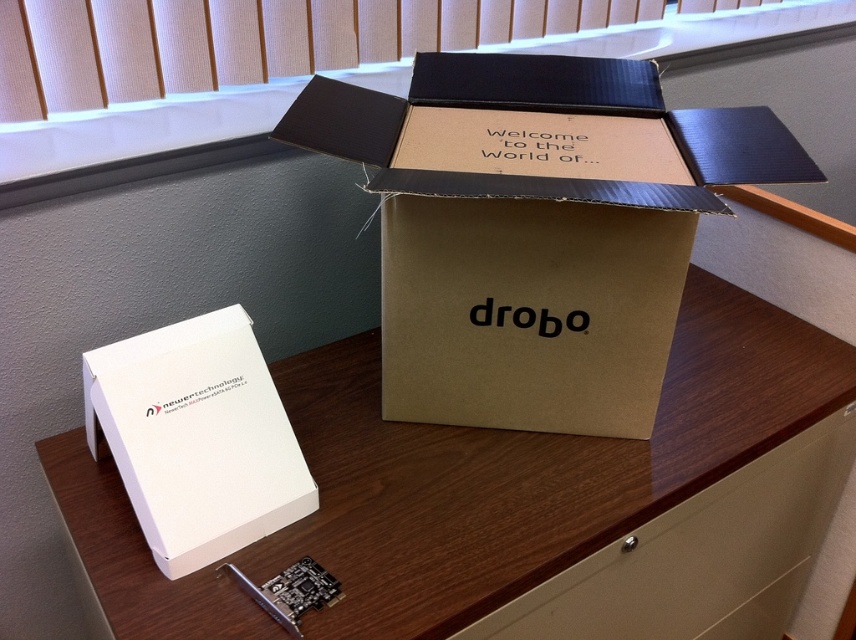
Is white cardboard box at center bigger than white matte/newer technology box at lower left?

Yes, white cardboard box at center is bigger than white matte/newer technology box at lower left.

Between white cardboard box at center and white matte/newer technology box at lower left, which one has more height?

Standing taller between the two is white cardboard box at center.

The width and height of the screenshot is (856, 640). I want to click on white cardboard box at center, so click(530, 468).

Can you confirm if white cardboard box at center is bigger than brown cardboard box at center?

Correct, white cardboard box at center is larger in size than brown cardboard box at center.

Does white cardboard box at center appear over brown cardboard box at center?

No, white cardboard box at center is not above brown cardboard box at center.

Who is more distant from viewer, (440, 541) or (465, 275)?

The point (465, 275) is more distant.

You are a GUI agent. You are given a task and a screenshot of the screen. Output one action in this format:
    pyautogui.click(x=<x>, y=<y>)
    Task: Click on the white cardboard box at center
    This screenshot has height=640, width=856.
    Given the screenshot: What is the action you would take?
    pyautogui.click(x=530, y=468)

Does brown cardboard box at center appear over white matte/newer technology box at lower left?

Indeed, brown cardboard box at center is positioned over white matte/newer technology box at lower left.

Does brown cardboard box at center have a smaller size compared to white matte/newer technology box at lower left?

Actually, brown cardboard box at center might be larger than white matte/newer technology box at lower left.

Which is behind, point (614, 417) or point (276, 424)?

The point (614, 417) is more distant.

You are a GUI agent. You are given a task and a screenshot of the screen. Output one action in this format:
    pyautogui.click(x=<x>, y=<y>)
    Task: Click on the brown cardboard box at center
    The image size is (856, 640).
    Given the screenshot: What is the action you would take?
    pyautogui.click(x=536, y=228)